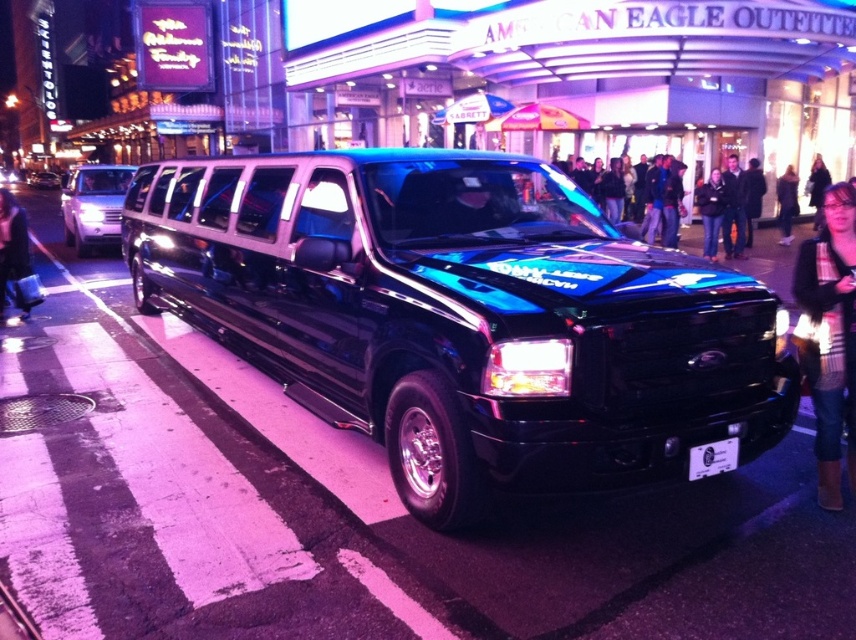
You are a GUI agent. You are given a task and a screenshot of the screen. Output one action in this format:
    pyautogui.click(x=<x>, y=<y>)
    Task: Click on the metallic blue car at center
    
    Given the screenshot: What is the action you would take?
    pyautogui.click(x=727, y=211)

Does metallic blue car at center have a lesser width compared to shiny black limousine at center?

Correct, metallic blue car at center's width is less than shiny black limousine at center's.

Does point (749, 173) come farther from viewer compared to point (52, 186)?

No.

The image size is (856, 640). In order to click on metallic blue car at center in this screenshot , I will do `click(727, 211)`.

Does black glossy limousine at center have a lesser width compared to striped sweater at lower right?

No, black glossy limousine at center is not thinner than striped sweater at lower right.

Is black glossy limousine at center positioned in front of striped sweater at lower right?

No.

Which is behind, point (642, 324) or point (831, 285)?

The point (831, 285) is behind.

This screenshot has height=640, width=856. In order to click on black glossy limousine at center in this screenshot , I will do `click(464, 317)`.

Does metallic silver suv at left have a smaller size compared to white plastic license plate at center?

Incorrect, metallic silver suv at left is not smaller in size than white plastic license plate at center.

Between metallic silver suv at left and white plastic license plate at center, which one appears on the left side from the viewer's perspective?

Positioned to the left is metallic silver suv at left.

I want to click on metallic silver suv at left, so click(x=93, y=205).